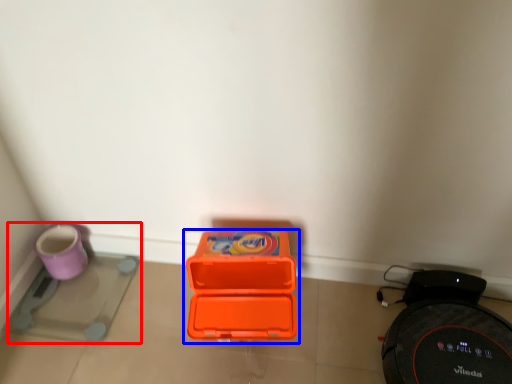
Question: Which object is closer to the camera taking this photo, appliance (highlighted by a red box) or box (highlighted by a blue box)?

Choices:
 (A) appliance
 (B) box

Answer: (B)